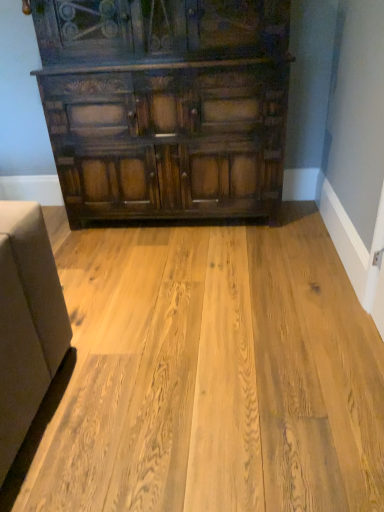
Question: Considering their positions, is natural wood floor at center located in front of or behind dark wood cabinet at upper center?

Choices:
 (A) front
 (B) behind

Answer: (A)

Question: Is natural wood floor at center bigger or smaller than dark wood cabinet at upper center?

Choices:
 (A) small
 (B) big

Answer: (A)

Question: From their relative heights in the image, would you say natural wood floor at center is taller or shorter than dark wood cabinet at upper center?

Choices:
 (A) tall
 (B) short

Answer: (B)

Question: Is dark wood cabinet at upper center situated inside natural wood floor at center or outside?

Choices:
 (A) inside
 (B) outside

Answer: (B)

Question: Is dark wood cabinet at upper center in front of or behind natural wood floor at center in the image?

Choices:
 (A) front
 (B) behind

Answer: (B)

Question: From the image's perspective, is dark wood cabinet at upper center above or below natural wood floor at center?

Choices:
 (A) below
 (B) above

Answer: (B)

Question: In the image, is dark wood cabinet at upper center on the left side or the right side of natural wood floor at center?

Choices:
 (A) left
 (B) right

Answer: (B)